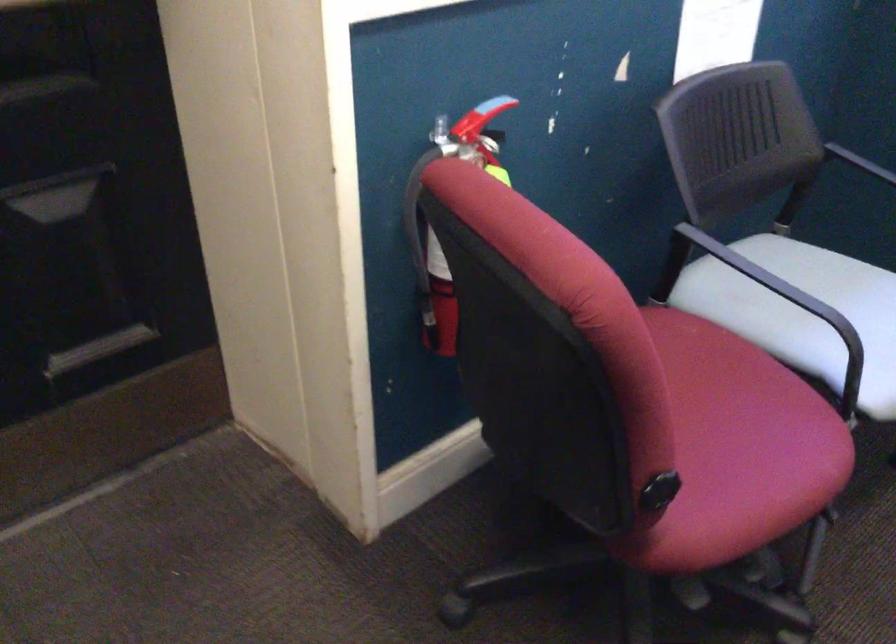
Find where to rest the black chair armrest. Please return your answer as a coordinate pair (x, y).

(785, 297)